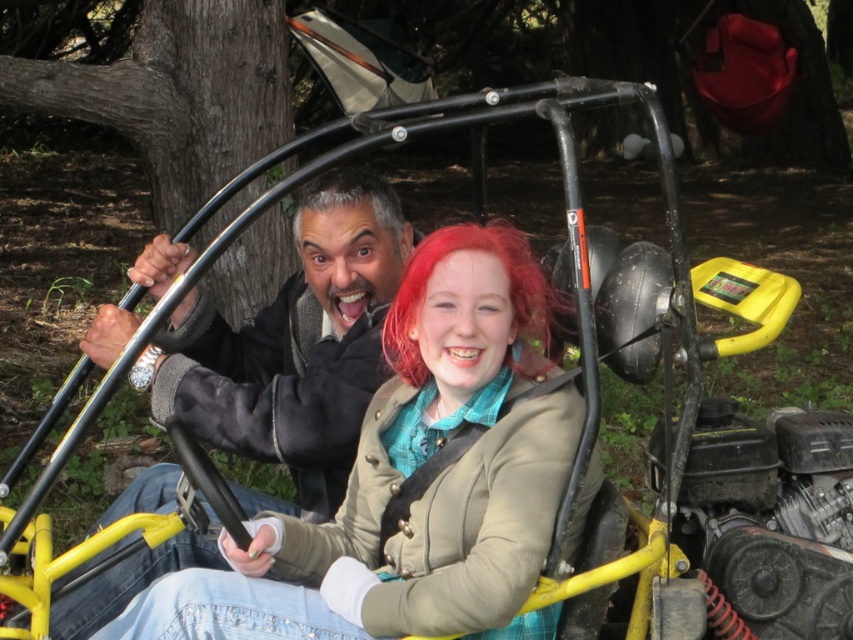
Question: Is matte beige jacket at center smaller than gray matte hair at center?

Choices:
 (A) no
 (B) yes

Answer: (A)

Question: In this image, where is matte beige jacket at center located relative to gray matte hair at center?

Choices:
 (A) left
 (B) right

Answer: (B)

Question: Which point is closer to the camera?

Choices:
 (A) (376, 214)
 (B) (372, 579)

Answer: (B)

Question: Does matte beige jacket at center come in front of gray matte hair at center?

Choices:
 (A) yes
 (B) no

Answer: (A)

Question: Which of the following is the closest to the observer?

Choices:
 (A) gray matte hair at center
 (B) matte beige jacket at center

Answer: (B)